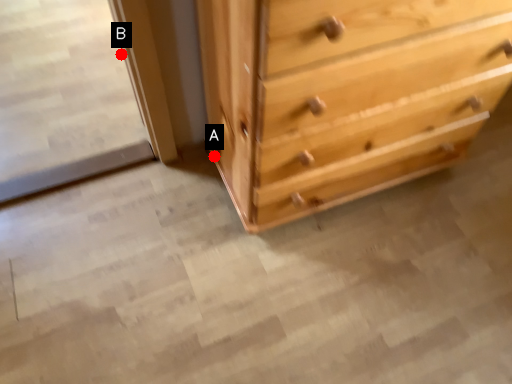
Question: Two points are circled on the image, labeled by A and B beside each circle. Which point is closer to the camera?

Choices:
 (A) A is closer
 (B) B is closer

Answer: (A)